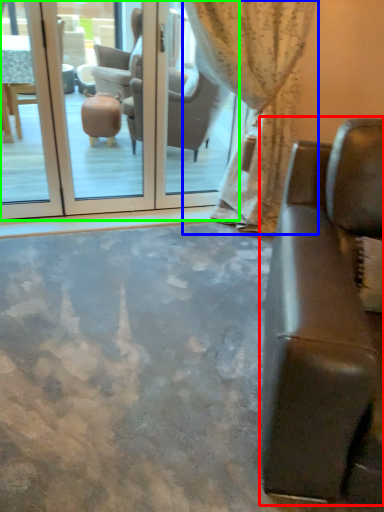
Question: Which object is the closest to the studio couch (highlighted by a red box)? Choose among these: curtain (highlighted by a blue box) or screen door (highlighted by a green box).

Choices:
 (A) curtain
 (B) screen door

Answer: (A)